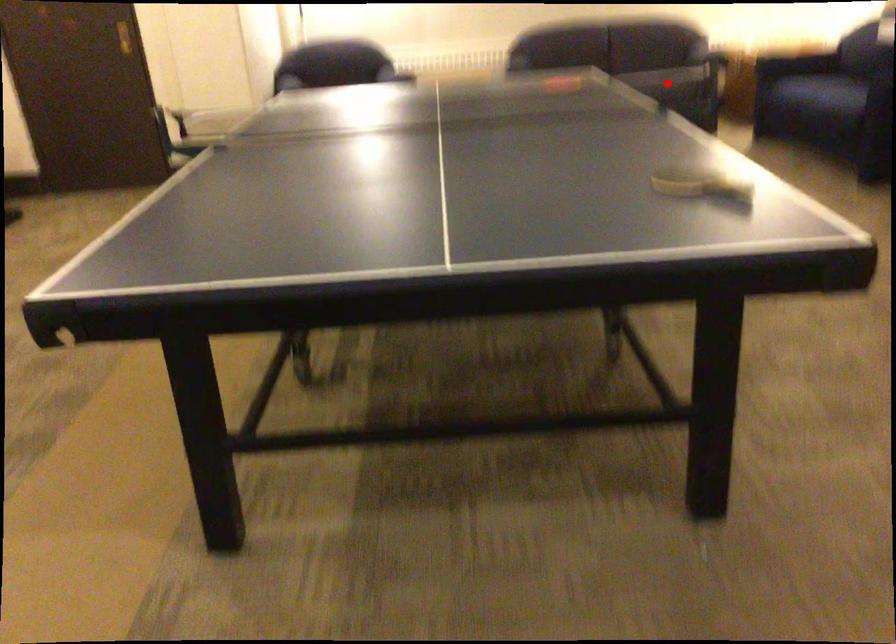
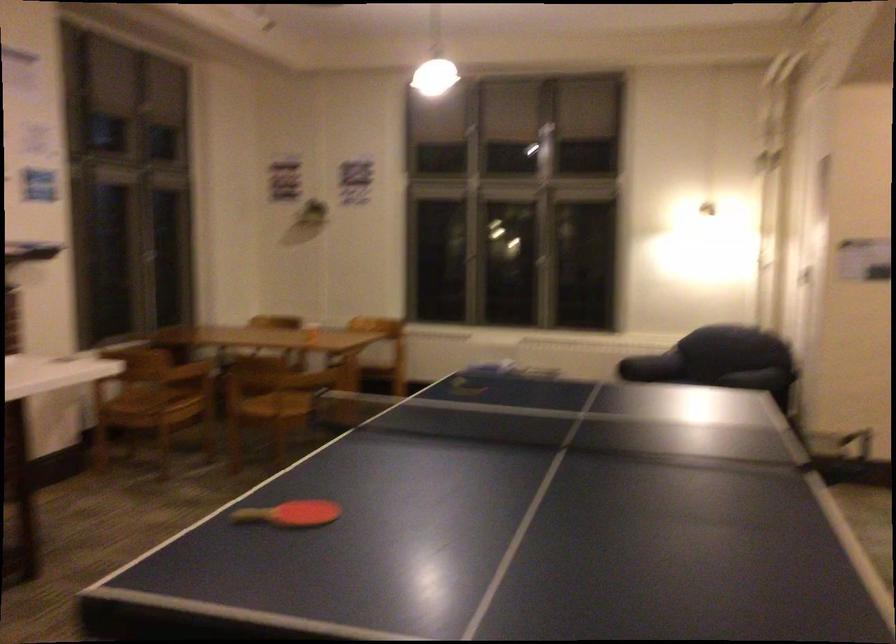
Question: I am providing you with two images of the same scene from different viewpoints. A red point is marked on the first image. At the location where the point appears in image 1, is it still visible in image 2?

Choices:
 (A) Yes
 (B) No

Answer: (B)